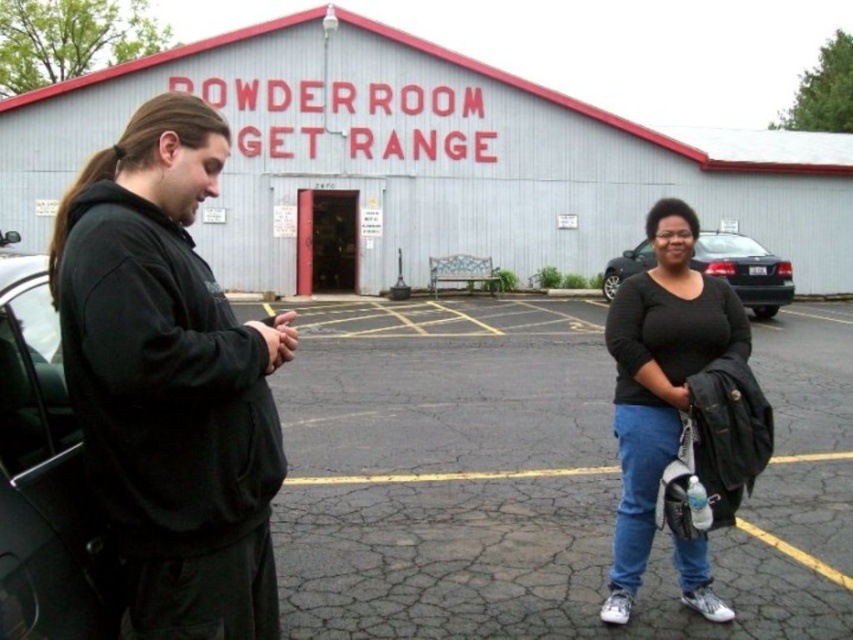
Question: Where is black asphalt parking lot at center located in relation to black matte hoodie at left in the image?

Choices:
 (A) left
 (B) right

Answer: (B)

Question: Can you confirm if black matte hoodie at left is positioned to the left of black matte shirt at center?

Choices:
 (A) yes
 (B) no

Answer: (A)

Question: Which object is the farthest from the black matte shirt at center?

Choices:
 (A) black matte hoodie at left
 (B) black glossy sedan at center
 (C) black asphalt parking lot at center
 (D) black matte car at left

Answer: (B)

Question: Which of the following is the farthest from the observer?

Choices:
 (A) (659, 419)
 (B) (38, 429)

Answer: (A)

Question: Which of these objects is positioned farthest from the black matte shirt at center?

Choices:
 (A) black glossy sedan at center
 (B) black matte hoodie at left

Answer: (A)

Question: Does black matte hoodie at left lie behind black matte shirt at center?

Choices:
 (A) yes
 (B) no

Answer: (B)